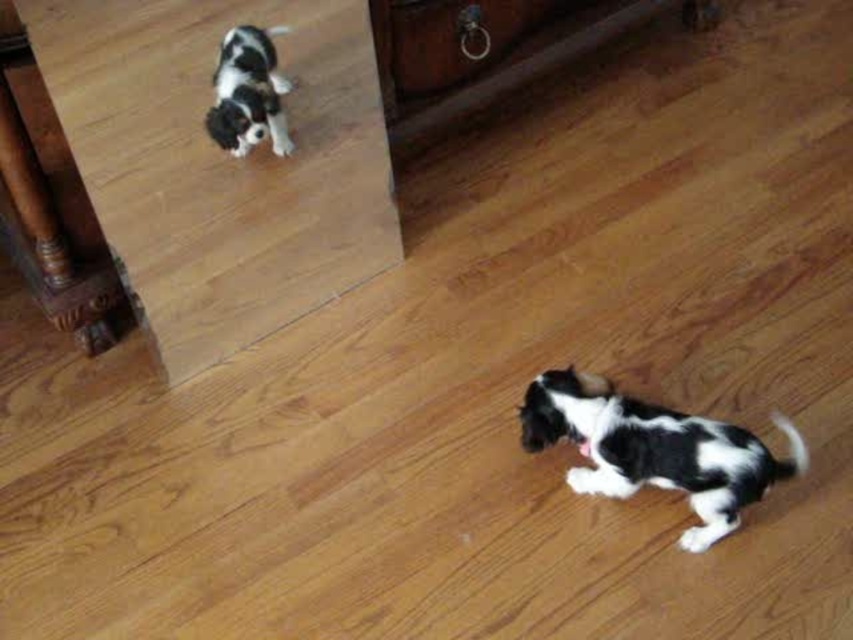
Question: Can you confirm if black and white fur dog at lower right is wider than black and white fur dog at upper left?

Choices:
 (A) no
 (B) yes

Answer: (B)

Question: Which point is closer to the camera taking this photo?

Choices:
 (A) (242, 129)
 (B) (614, 401)

Answer: (B)

Question: Which object is positioned farthest from the black and white fur dog at upper left?

Choices:
 (A) matte brown drawer at upper center
 (B) black and white fur dog at lower right

Answer: (B)

Question: Does matte brown drawer at upper center appear on the left side of black and white fur dog at upper left?

Choices:
 (A) yes
 (B) no

Answer: (B)

Question: Is matte brown drawer at upper center closer to camera compared to black and white fur dog at upper left?

Choices:
 (A) no
 (B) yes

Answer: (A)

Question: Which point is farther to the camera?

Choices:
 (A) matte brown drawer at upper center
 (B) black and white fur dog at upper left
 (C) black and white fur dog at lower right

Answer: (A)